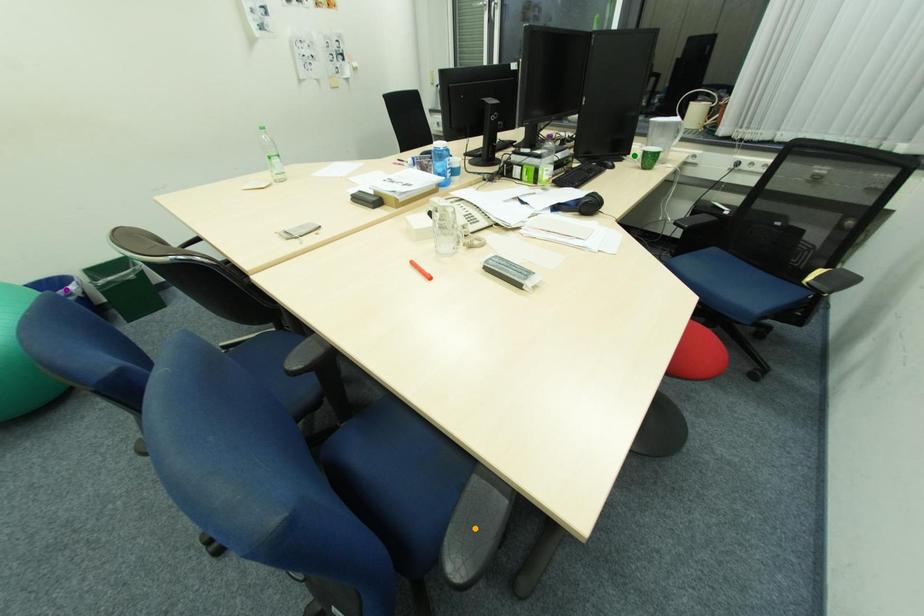
Order these from farthest to nearest:
A) green point
B) orange point
C) purple point

green point < purple point < orange point